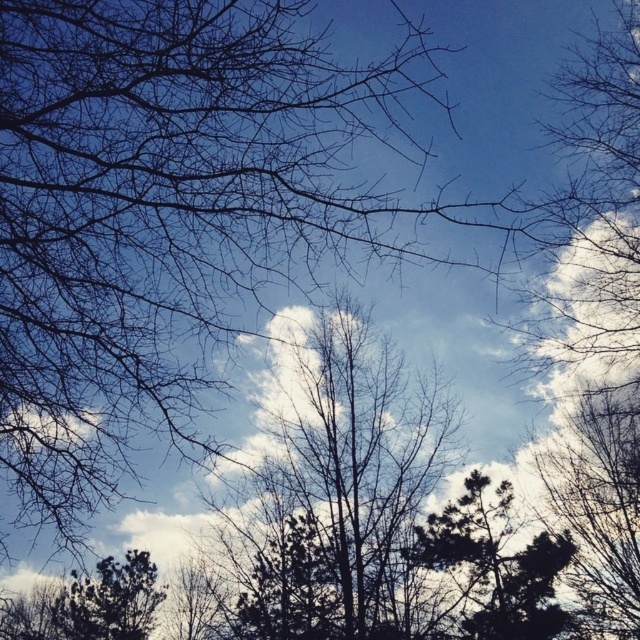
Based on the photo, you are a photographer trying to capture the two points in the scene. Which point, point (438, 472) or point (468, 548), is closer to your camera lens?

Point (438, 472) is closer to the camera than point (468, 548).